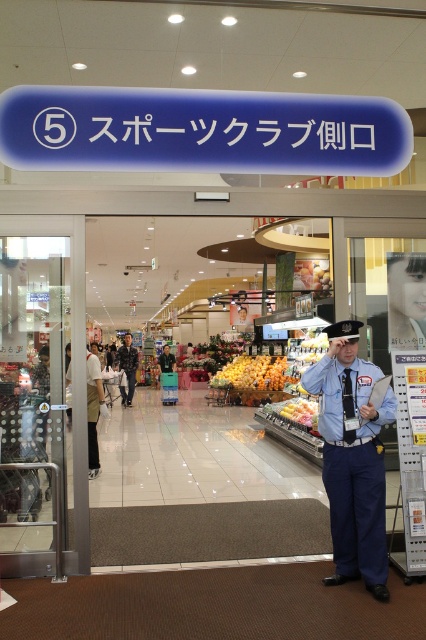
You are a delivery person standing at the entrance of the supermarket labeled 5. You need to hand over a package to someone inside. You see the glossy orange fruits at center and the camouflage fabric uniform at center. How far apart are these two items?

The glossy orange fruits at center and the camouflage fabric uniform at center are 3.57 meters apart.

You are standing at the entrance of the supermarket labeled as 5 Sports Club Side Entrance. You see a point marked at coordinates (253, 372). Based on the scene description, what object is located at that point?

The point at coordinates (253, 372) corresponds to glossy orange fruits at center.